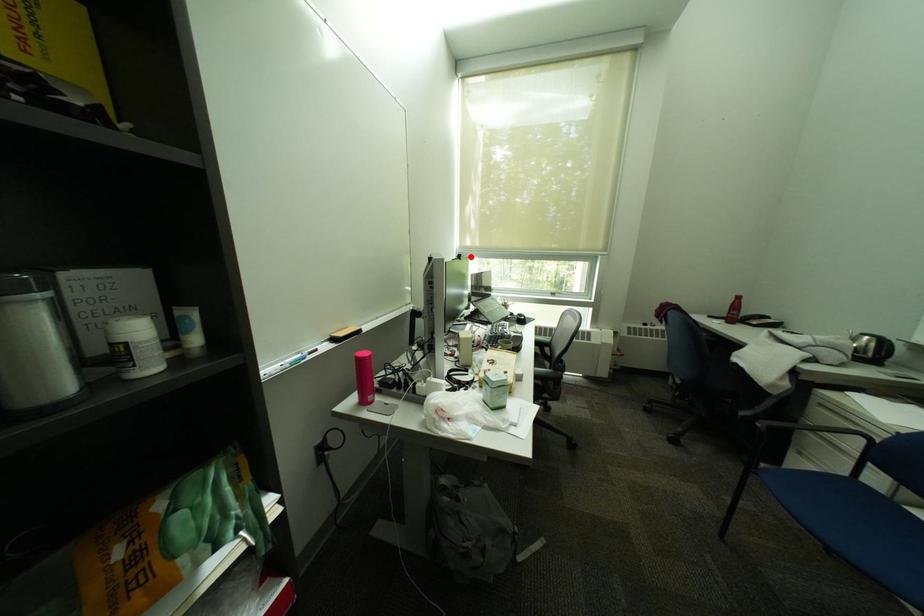
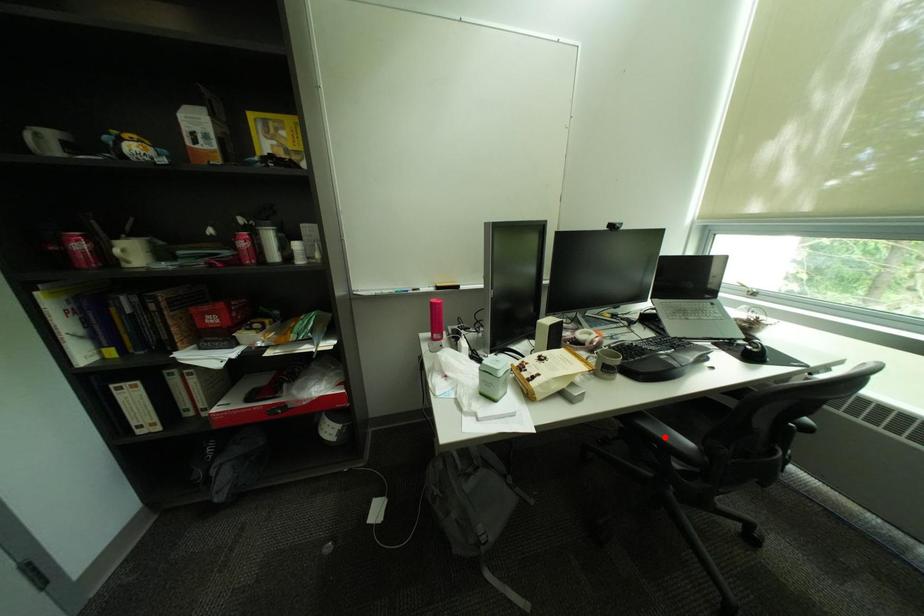
I am providing you with two images of the same scene from different viewpoints. A red point is marked on the first image and another point is marked on the second image. Does the point marked in image1 correspond to the same location as the one in image2?

No